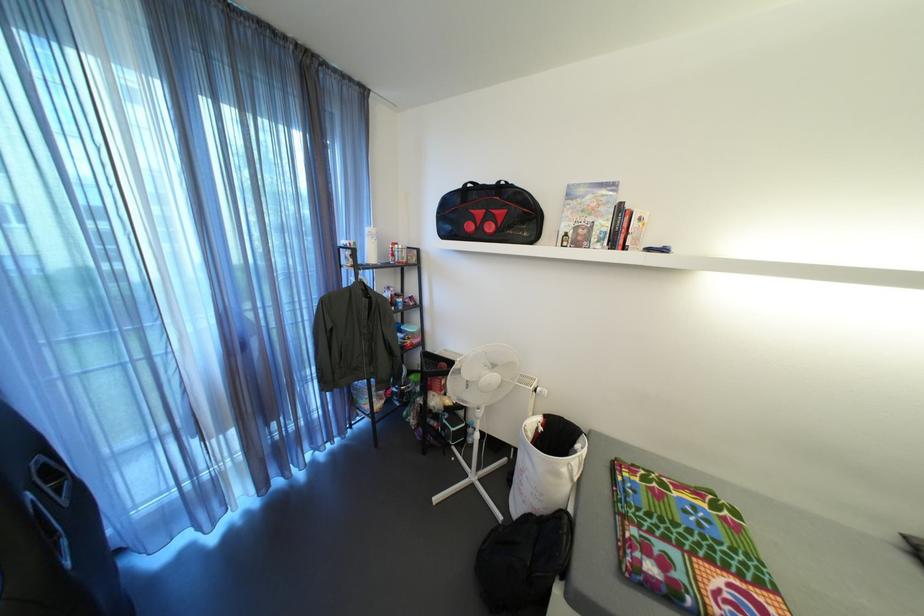
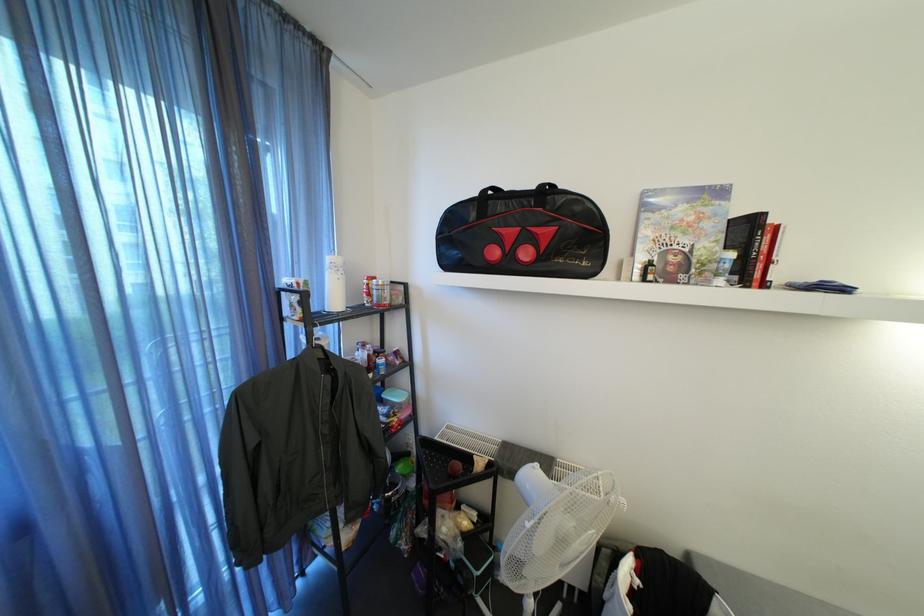
Question: How did the camera likely rotate?

Choices:
 (A) Left
 (B) Right
 (C) Up
 (D) Down

Answer: (B)